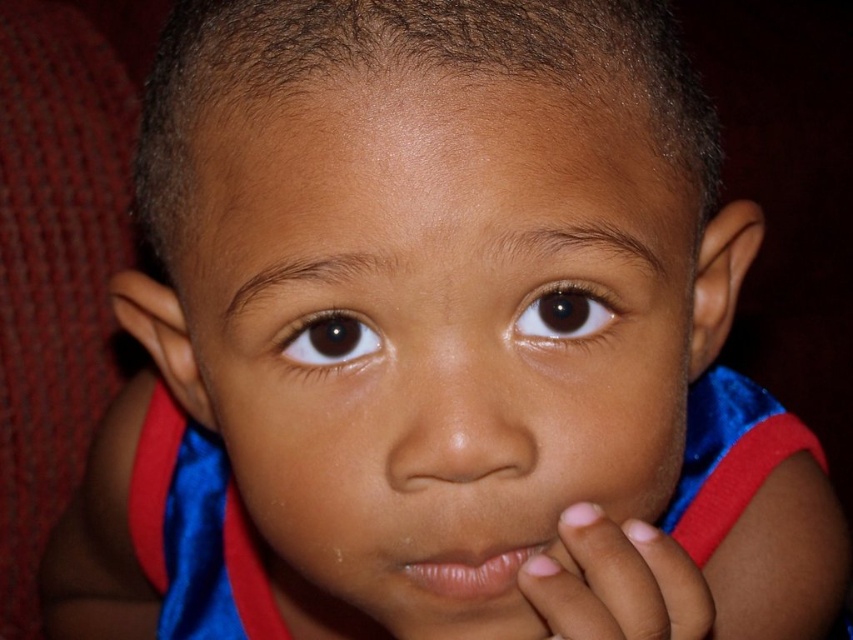
Does smooth skin hand at lower center appear on the left side of smooth skin nose at center?

In fact, smooth skin hand at lower center is to the right of smooth skin nose at center.

The image size is (853, 640). Describe the element at coordinates (616, 582) in the screenshot. I see `smooth skin hand at lower center` at that location.

You are a GUI agent. You are given a task and a screenshot of the screen. Output one action in this format:
    pyautogui.click(x=<x>, y=<y>)
    Task: Click on the smooth skin hand at lower center
    Image resolution: width=853 pixels, height=640 pixels.
    Given the screenshot: What is the action you would take?
    pyautogui.click(x=616, y=582)

Between point (436, 371) and point (343, 314), which one is positioned in front?

Point (436, 371) is in front.

Which is behind, point (421, 381) or point (318, 364)?

The point (318, 364) is behind.

Is point (432, 420) farther from camera compared to point (293, 355)?

No, (432, 420) is in front of (293, 355).

Where is `smooth skin nose at center`? smooth skin nose at center is located at coordinates (457, 422).

Does point (408, 419) lie behind point (546, 540)?

No, (408, 419) is closer to viewer.

Which is above, smooth skin nose at center or pink smooth lips at center?

Positioned higher is smooth skin nose at center.

Is point (457, 390) behind point (457, 525)?

No, (457, 390) is closer to viewer.

Where is `smooth skin nose at center`? The image size is (853, 640). smooth skin nose at center is located at coordinates (457, 422).